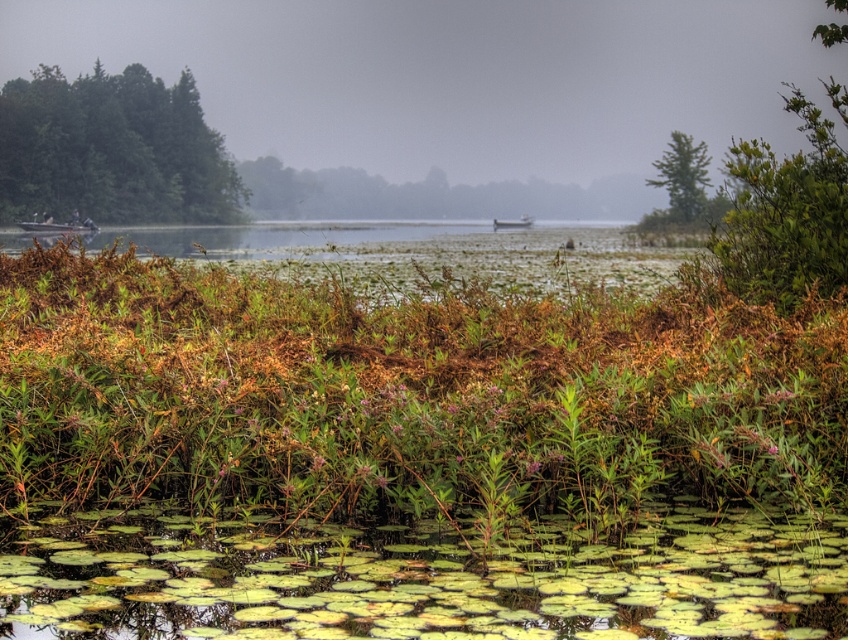
Is green leafy bush at upper right taller than white plastic boat at center?

Indeed, green leafy bush at upper right has a greater height compared to white plastic boat at center.

Is green leafy bush at upper right further to the viewer compared to white plastic boat at center?

No, it is in front of white plastic boat at center.

Measure the distance between green leafy bush at upper right and camera.

They are 39.88 feet apart.

Where is `green leafy bush at upper right`? green leafy bush at upper right is located at coordinates (785, 214).

Is foggy mist at center below white plastic boat at center?

Actually, foggy mist at center is above white plastic boat at center.

Between foggy mist at center and white plastic boat at center, which one has less height?

Standing shorter between the two is white plastic boat at center.

Is point (707, 93) farther from viewer compared to point (492, 221)?

Yes, it is.

Find the location of a particular element. The width and height of the screenshot is (848, 640). foggy mist at center is located at coordinates (455, 77).

At what (x,y) coordinates should I click in order to perform the action: click on foggy mist at center. Please return your answer as a coordinate pair (x, y). The height and width of the screenshot is (640, 848). Looking at the image, I should click on (455, 77).

Which of these two, foggy mist at center or wooden boat at left, stands taller?

foggy mist at center is taller.

This screenshot has height=640, width=848. Find the location of `foggy mist at center`. foggy mist at center is located at coordinates (455, 77).